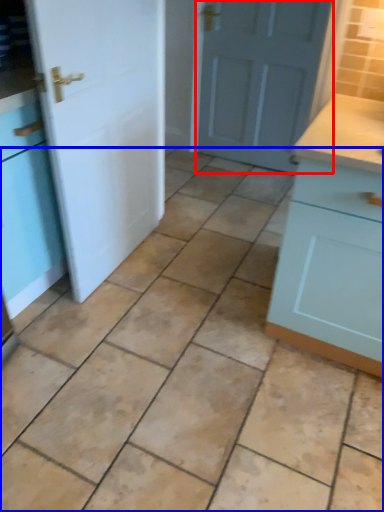
Question: Among these objects, which one is farthest to the camera, door (highlighted by a red box) or ceramic tile (highlighted by a blue box)?

Choices:
 (A) door
 (B) ceramic tile

Answer: (A)